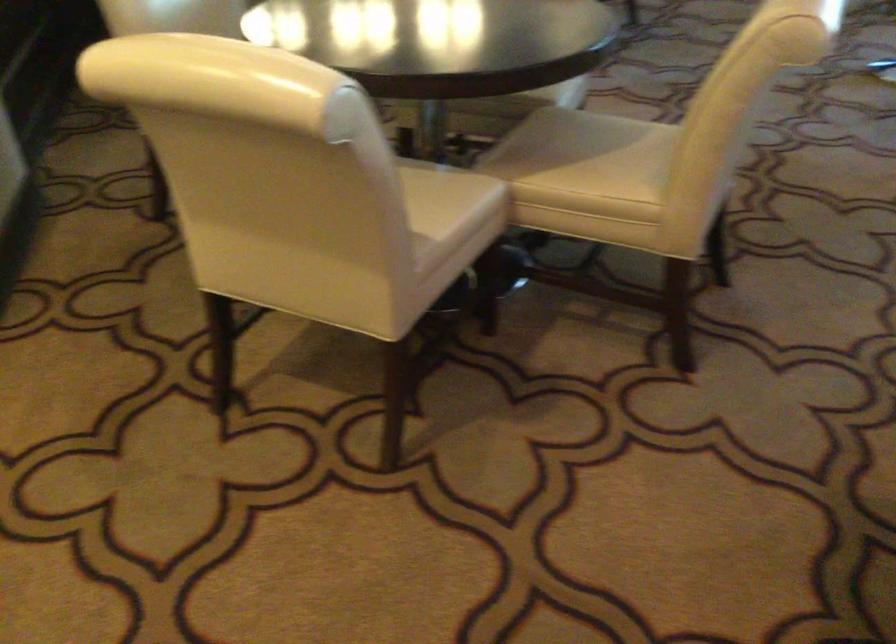
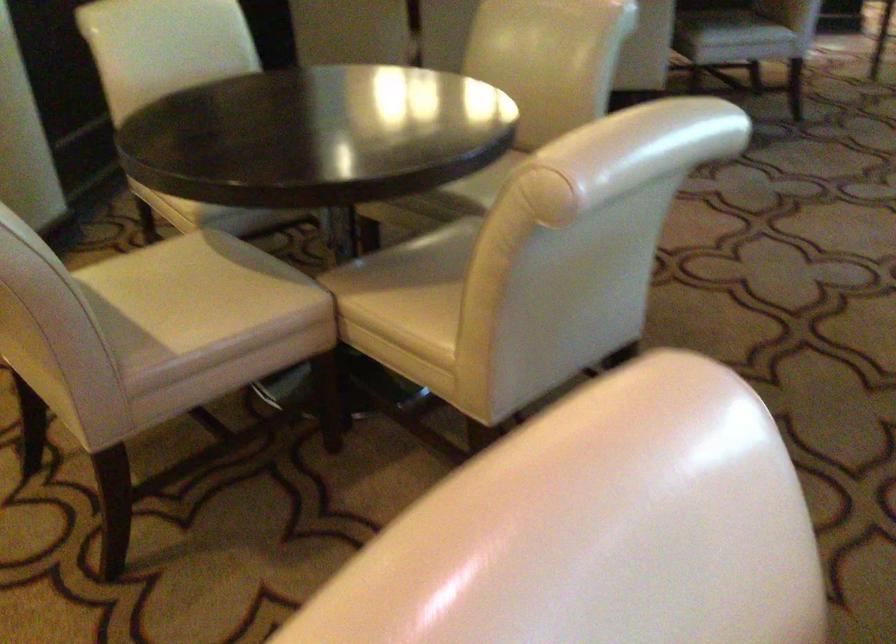
Question: How did the camera likely rotate?

Choices:
 (A) Left
 (B) Right
 (C) Up
 (D) Down

Answer: (A)